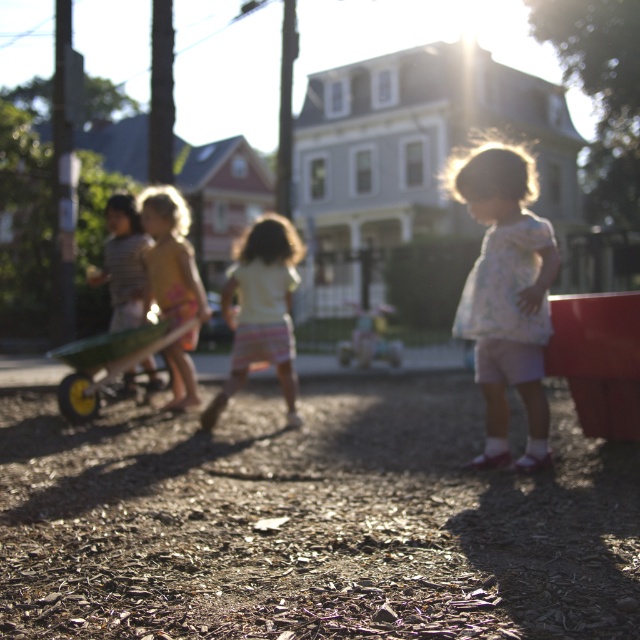
You are observing a playground scene. There is a child wearing pastel striped shorts at center. Where exactly is this child positioned in the image?

The pastel striped shorts at center is located at point [260,308].

You are a photographer trying to capture a photo of the pastel striped shorts at center in the playground scene. Based on their position, where should you aim your camera to ensure they are in the frame?

The pastel striped shorts at center are located at point (260, 308), so aim your camera towards the coordinates 0.484 on the x and 0.409 on the y axis to capture them in the frame.

You are a parent trying to locate your child who is wearing pastel striped shorts at center and yellow cotton shirt at center. Based on the scene, how far apart are these two items of clothing?

The pastel striped shorts at center is 35.01 inches away from the yellow cotton shirt at center.